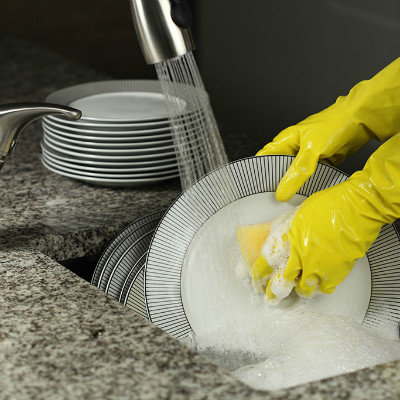
At what (x,y) coordinates should I click in order to perform the action: click on faucet. Please return your answer as a coordinate pair (x, y). Image resolution: width=400 pixels, height=400 pixels. Looking at the image, I should click on (165, 41).